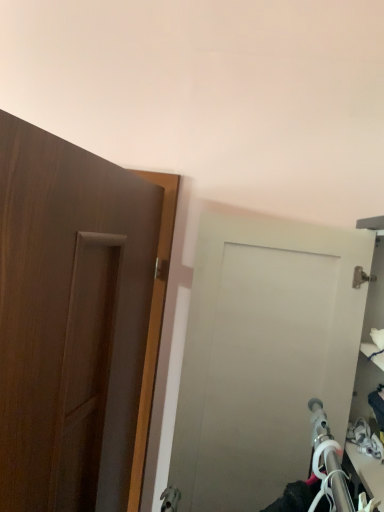
Locate an element on the screen. Image resolution: width=384 pixels, height=512 pixels. matte white door at center, which is counted as the 2th door, starting from the left is located at coordinates (264, 355).

The width and height of the screenshot is (384, 512). What do you see at coordinates (264, 355) in the screenshot? I see `matte white door at center, the first door in the right-to-left sequence` at bounding box center [264, 355].

The height and width of the screenshot is (512, 384). What do you see at coordinates (70, 320) in the screenshot? I see `wooden door at left, which is the first door from left to right` at bounding box center [70, 320].

Where is `wooden door at left, which ranks as the second door in right-to-left order`? The width and height of the screenshot is (384, 512). wooden door at left, which ranks as the second door in right-to-left order is located at coordinates (70, 320).

Identify the location of matte white door at center, the first door in the right-to-left sequence. The height and width of the screenshot is (512, 384). (264, 355).

Looking at this image, which is more to the right, matte white door at center, the first door in the right-to-left sequence, or wooden door at left, which is the first door from left to right?

matte white door at center, the first door in the right-to-left sequence.

In the image, is matte white door at center, which is counted as the 2th door, starting from the left, positioned in front of or behind wooden door at left, which is the first door from left to right?

matte white door at center, which is counted as the 2th door, starting from the left, is behind wooden door at left, which is the first door from left to right.

Is point (234, 230) closer to camera compared to point (93, 323)?

No, (234, 230) is behind (93, 323).

From the image's perspective, is matte white door at center, the first door in the right-to-left sequence, positioned above or below wooden door at left, which ranks as the second door in right-to-left order?

Clearly, from the image's perspective, matte white door at center, the first door in the right-to-left sequence, is below wooden door at left, which ranks as the second door in right-to-left order.

From a real-world perspective, who is located higher, matte white door at center, which is counted as the 2th door, starting from the left, or wooden door at left, which is the first door from left to right?

matte white door at center, which is counted as the 2th door, starting from the left, is physically above.

Is matte white door at center, which is counted as the 2th door, starting from the left, wider or thinner than wooden door at left, which is the first door from left to right?

Clearly, matte white door at center, which is counted as the 2th door, starting from the left, has more width compared to wooden door at left, which is the first door from left to right.

From their relative heights in the image, would you say matte white door at center, which is counted as the 2th door, starting from the left, is taller or shorter than wooden door at left, which is the first door from left to right?

Considering their sizes, matte white door at center, which is counted as the 2th door, starting from the left, has less height than wooden door at left, which is the first door from left to right.

Can you confirm if matte white door at center, which is counted as the 2th door, starting from the left, is bigger than wooden door at left, which ranks as the second door in right-to-left order?

Correct, matte white door at center, which is counted as the 2th door, starting from the left, is larger in size than wooden door at left, which ranks as the second door in right-to-left order.

Could wooden door at left, which ranks as the second door in right-to-left order, be considered to be inside matte white door at center, which is counted as the 2th door, starting from the left?

No.

Is matte white door at center, the first door in the right-to-left sequence, placed right next to wooden door at left, which is the first door from left to right?

matte white door at center, the first door in the right-to-left sequence, is not next to wooden door at left, which is the first door from left to right, and they're not touching.

Is matte white door at center, which is counted as the 2th door, starting from the left, aimed at wooden door at left, which ranks as the second door in right-to-left order?

Yes, matte white door at center, which is counted as the 2th door, starting from the left, is oriented towards wooden door at left, which ranks as the second door in right-to-left order.

How different are the orientations of matte white door at center, which is counted as the 2th door, starting from the left, and wooden door at left, which is the first door from left to right, in degrees?

4.63 degrees separate the facing orientations of matte white door at center, which is counted as the 2th door, starting from the left, and wooden door at left, which is the first door from left to right.

The width and height of the screenshot is (384, 512). Find the location of `door above the matte white door at center, the first door in the right-to-left sequence (from the image's perspective)`. door above the matte white door at center, the first door in the right-to-left sequence (from the image's perspective) is located at coordinates (70, 320).

Based on the photo, which object is positioned more to the left, wooden door at left, which ranks as the second door in right-to-left order, or matte white door at center, the first door in the right-to-left sequence?

wooden door at left, which ranks as the second door in right-to-left order.

Between wooden door at left, which ranks as the second door in right-to-left order, and matte white door at center, which is counted as the 2th door, starting from the left, which one is positioned behind?

matte white door at center, which is counted as the 2th door, starting from the left, is more distant.

Is point (90, 395) closer or farther from the camera than point (245, 275)?

Point (90, 395) appears to be closer to the viewer than point (245, 275).

From the image's perspective, which one is positioned higher, wooden door at left, which is the first door from left to right, or matte white door at center, which is counted as the 2th door, starting from the left?

wooden door at left, which is the first door from left to right, appears higher in the image.

From a real-world perspective, which object stands above the other?

matte white door at center, the first door in the right-to-left sequence, from a real-world perspective.

Looking at their sizes, would you say wooden door at left, which is the first door from left to right, is wider or thinner than matte white door at center, the first door in the right-to-left sequence?

Clearly, wooden door at left, which is the first door from left to right, has less width compared to matte white door at center, the first door in the right-to-left sequence.

Between wooden door at left, which is the first door from left to right, and matte white door at center, the first door in the right-to-left sequence, which one has less height?

matte white door at center, the first door in the right-to-left sequence, is shorter.

Looking at the image, does wooden door at left, which is the first door from left to right, seem bigger or smaller compared to matte white door at center, which is counted as the 2th door, starting from the left?

wooden door at left, which is the first door from left to right, is smaller than matte white door at center, which is counted as the 2th door, starting from the left.

Could matte white door at center, which is counted as the 2th door, starting from the left, be considered to be inside wooden door at left, which ranks as the second door in right-to-left order?

Actually, matte white door at center, which is counted as the 2th door, starting from the left, is outside wooden door at left, which ranks as the second door in right-to-left order.

Is wooden door at left, which ranks as the second door in right-to-left order, touching matte white door at center, the first door in the right-to-left sequence?

No, wooden door at left, which ranks as the second door in right-to-left order, is not touching matte white door at center, the first door in the right-to-left sequence.

Is wooden door at left, which ranks as the second door in right-to-left order, looking in the opposite direction of matte white door at center, the first door in the right-to-left sequence?

That's right, wooden door at left, which ranks as the second door in right-to-left order, is facing away from matte white door at center, the first door in the right-to-left sequence.

What's the angular difference between wooden door at left, which is the first door from left to right, and matte white door at center, which is counted as the 2th door, starting from the left,'s facing directions?

wooden door at left, which is the first door from left to right, and matte white door at center, which is counted as the 2th door, starting from the left, are facing 4.63 degrees away from each other.

Where is `door behind the wooden door at left, which is the first door from left to right`? The width and height of the screenshot is (384, 512). door behind the wooden door at left, which is the first door from left to right is located at coordinates (264, 355).

Locate an element on the screen. door above the wooden door at left, which is the first door from left to right (from a real-world perspective) is located at coordinates (264, 355).

Identify the location of door lying above the matte white door at center, which is counted as the 2th door, starting from the left (from the image's perspective). The image size is (384, 512). (70, 320).